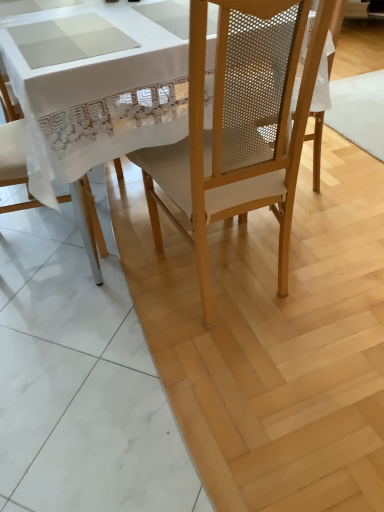
Find the location of a particular element. vacant space in matte wood chair at center, which is counted as the second chair, starting from the left (from a real-world perspective) is located at coordinates (230, 279).